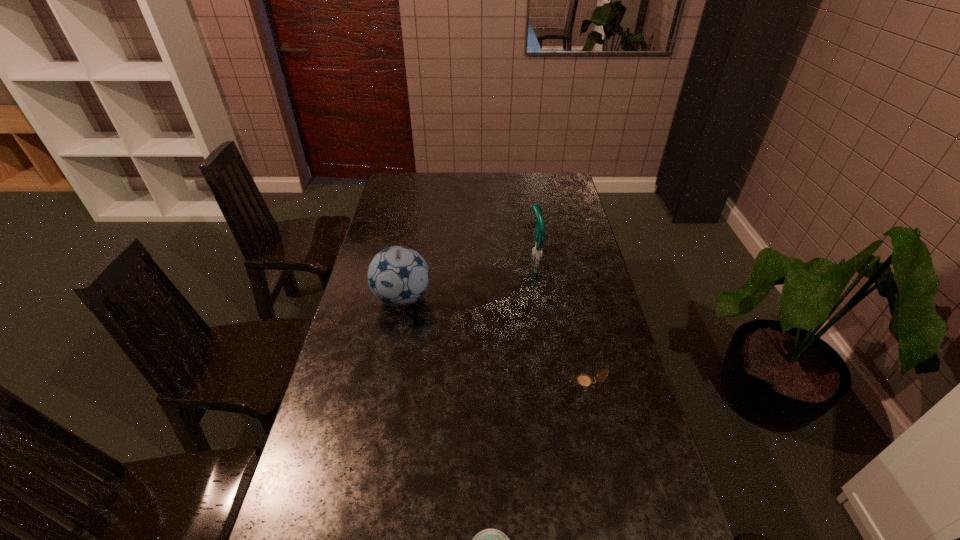
Identify the location of the second object from right to left. (540, 232).

Where is `bottle opener`? bottle opener is located at coordinates (540, 232).

Where is `the third nearest object`? The image size is (960, 540). the third nearest object is located at coordinates (398, 276).

Locate an element on the screen. the leftmost object is located at coordinates (398, 276).

The height and width of the screenshot is (540, 960). In order to click on the rightmost object in this screenshot , I will do `click(585, 381)`.

What are the coordinates of `the third farthest object` in the screenshot? It's located at (585, 381).

Where is `vacant space located at the jaws of the third object from left to right`? This screenshot has width=960, height=540. vacant space located at the jaws of the third object from left to right is located at coordinates (502, 254).

Find the location of `vacant space located 0.120m at the jaws of the third object from left to right`. vacant space located 0.120m at the jaws of the third object from left to right is located at coordinates (497, 254).

You are a GUI agent. You are given a task and a screenshot of the screen. Output one action in this format:
    pyautogui.click(x=<x>, y=<y>)
    Task: Click on the free space located 0.350m at the jaws of the third object from left to right
    
    Given the screenshot: What is the action you would take?
    pyautogui.click(x=439, y=254)

Find the location of a particular element. free space located on the side with brand of the third nearest object is located at coordinates (396, 336).